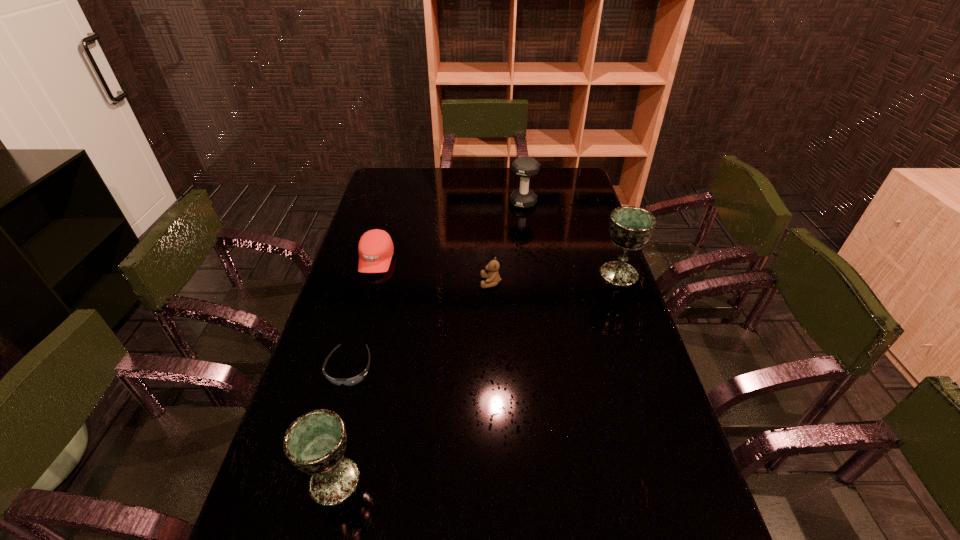
Find the location of a particular element. vacant point located between the sunglasses and the cap is located at coordinates (363, 314).

Where is `free area in between the nearest object and the tallest object`? The height and width of the screenshot is (540, 960). free area in between the nearest object and the tallest object is located at coordinates (477, 377).

At what (x,y) coordinates should I click in order to perform the action: click on free space between the rightmost object and the dumbbell. Please return your answer as a coordinate pair (x, y). Image resolution: width=960 pixels, height=540 pixels. Looking at the image, I should click on (571, 239).

I want to click on free space between the taller chalice and the third object from right to left, so click(555, 278).

Image resolution: width=960 pixels, height=540 pixels. I want to click on empty space between the fourth object from left to right and the sunglasses, so click(420, 326).

The image size is (960, 540). I want to click on vacant point located between the second nearest object and the fourth object from left to right, so click(x=420, y=326).

You are a GUI agent. You are given a task and a screenshot of the screen. Output one action in this format:
    pyautogui.click(x=<x>, y=<y>)
    Task: Click on the vacant region between the dumbbell and the shorter chalice
    The image size is (960, 540).
    Given the screenshot: What is the action you would take?
    pyautogui.click(x=429, y=342)

Locate an element on the screen. vacant point located between the taller chalice and the sunglasses is located at coordinates (484, 321).

Where is `vacant area between the nearer chalice and the teddy bear`? vacant area between the nearer chalice and the teddy bear is located at coordinates (413, 382).

Locate an element on the screen. object that stands as the third closest to the third object from right to left is located at coordinates (355, 380).